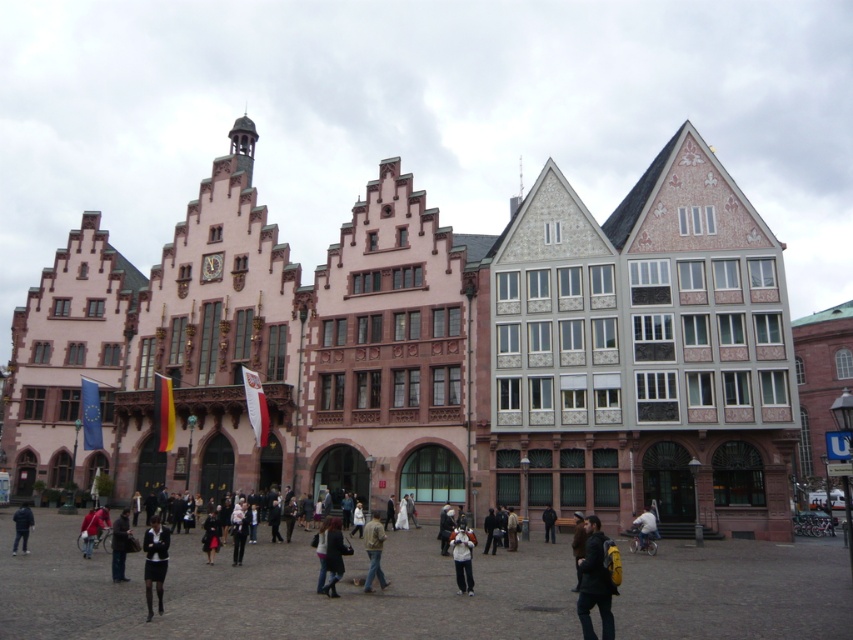
Can you confirm if denim jacket at center is wider than dark blue jacket at lower left?

No.

Which of these two, denim jacket at center or dark blue jacket at lower left, stands taller?

Standing taller between the two is dark blue jacket at lower left.

Locate an element on the screen. The height and width of the screenshot is (640, 853). denim jacket at center is located at coordinates (373, 550).

In the scene shown: Does dark blue jacket at lower left appear on the left side of light blue denim jacket at lower center?

Correct, you'll find dark blue jacket at lower left to the left of light blue denim jacket at lower center.

Between point (25, 541) and point (640, 531), which one is positioned in front?

Point (25, 541)

Measure the distance between dark blue jacket at lower left and camera.

A distance of 44.90 meters exists between dark blue jacket at lower left and camera.

Identify the location of dark blue jacket at lower left. (22, 525).

Is point (90, 509) closer to camera compared to point (641, 532)?

No, (90, 509) is behind (641, 532).

Is the position of red fabric jacket at lower left more distant than that of light blue denim jacket at lower center?

No, red fabric jacket at lower left is in front of light blue denim jacket at lower center.

I want to click on red fabric jacket at lower left, so click(91, 529).